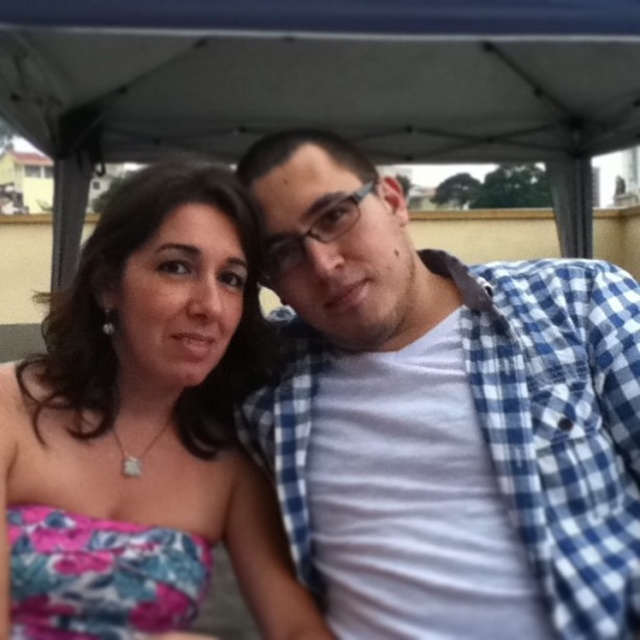
You are a photographer who needs to adjust the lighting between the blue checkered shirt at center and the pink floral dress at center. To ensure both are well lit, how far apart are they?

The blue checkered shirt at center is 8.02 inches from the pink floral dress at center, so you can adjust the lighting accordingly to ensure both are well lit.

You are a photographer trying to frame a shot of the blue checkered shirt at center and the pink floral dress at center. Which clothing item is wider in the image?

The blue checkered shirt at center is wider than the pink floral dress at center according to the description.